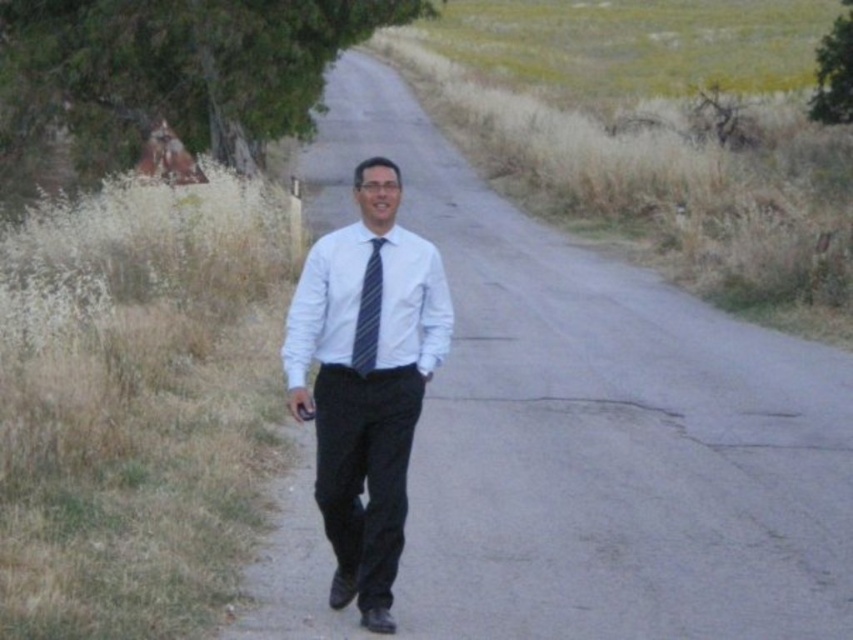
Does matte white shirt at center appear on the right side of blue striped tie at center?

Yes, matte white shirt at center is to the right of blue striped tie at center.

Who is taller, matte white shirt at center or blue striped tie at center?

With more height is matte white shirt at center.

Between point (366, 566) and point (358, 369), which one is positioned in front?

Point (366, 566) is in front.

The height and width of the screenshot is (640, 853). I want to click on matte white shirt at center, so click(366, 380).

Between matte asphalt road at center and green leafy tree at upper left, which one is positioned higher?

green leafy tree at upper left is higher up.

Does point (421, 433) come closer to viewer compared to point (231, 72)?

Yes, it is.

At what (x,y) coordinates should I click in order to perform the action: click on matte asphalt road at center. Please return your answer as a coordinate pair (x, y). Looking at the image, I should click on 595,426.

Is matte asphalt road at center below green leafy tree at upper right?

Yes.

Which is behind, point (491, 570) or point (821, 108)?

Point (821, 108)

Who is more forward, (820, 458) or (819, 77)?

Positioned in front is point (820, 458).

Find the location of `matte asphalt road at center`. matte asphalt road at center is located at coordinates (595, 426).